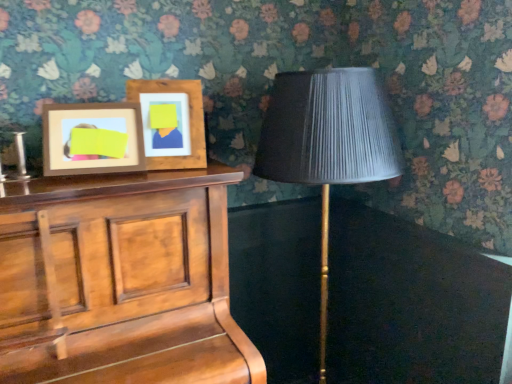
Locate an element on the screen. The height and width of the screenshot is (384, 512). free space in front of wooden picture frame at upper left, acting as the 2th picture frame starting from the right is located at coordinates (77, 185).